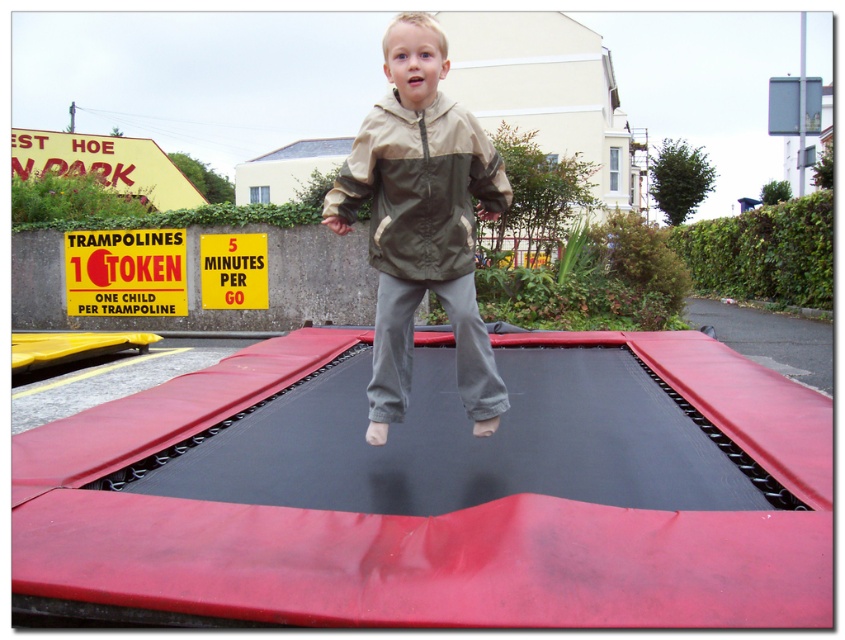
Question: Does khaki fabric jacket at center have a smaller size compared to tan/textured jacket at center?

Choices:
 (A) no
 (B) yes

Answer: (A)

Question: Is khaki fabric jacket at center below tan/textured jacket at center?

Choices:
 (A) yes
 (B) no

Answer: (A)

Question: Which object appears farthest from the camera in this image?

Choices:
 (A) tan/textured jacket at center
 (B) khaki fabric jacket at center

Answer: (A)

Question: Does khaki fabric jacket at center have a lesser width compared to tan/textured jacket at center?

Choices:
 (A) yes
 (B) no

Answer: (B)

Question: Which point is farther from the camera taking this photo?

Choices:
 (A) (417, 116)
 (B) (402, 381)

Answer: (B)

Question: Among these objects, which one is farthest from the camera?

Choices:
 (A) tan/textured jacket at center
 (B) khaki fabric jacket at center

Answer: (A)